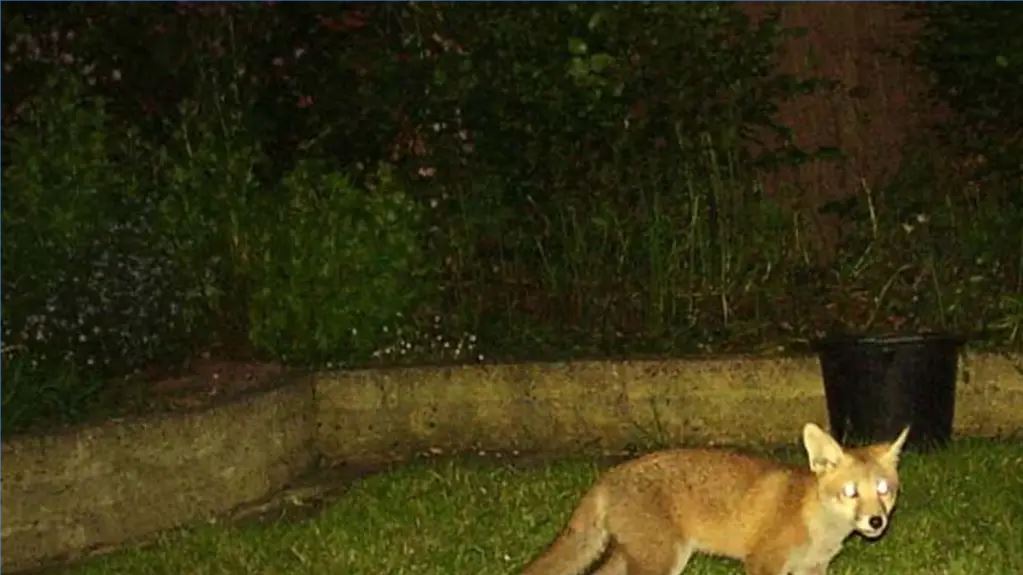
Find the location of a particular element. The height and width of the screenshot is (575, 1023). flower pot is located at coordinates (913, 387).